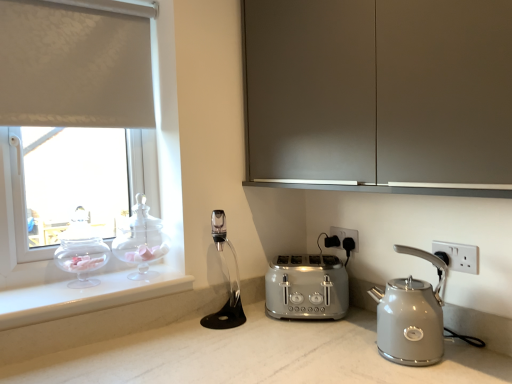
The height and width of the screenshot is (384, 512). I want to click on black plastic electric outlet at lower center, the 2th electric outlet viewed from the right, so click(x=345, y=235).

Locate an element on the screen. This screenshot has width=512, height=384. matte gray kettle at right is located at coordinates (411, 316).

This screenshot has height=384, width=512. What do you see at coordinates (306, 287) in the screenshot?
I see `satin silver toaster at center` at bounding box center [306, 287].

What is the approximate height of white plastic electric outlet at right, which is counted as the first electric outlet, starting from the front?

It is 3.47 inches.

What is the approximate height of transparent glass teapot at left, which is counted as the 1th tea pot, starting from the left?

It is 11.15 inches.

Locate an element on the screen. Image resolution: width=512 pixels, height=384 pixels. matte gray cabinet at upper center is located at coordinates (379, 95).

Between matte gray kettle at right and transparent glass teapot at left, which is the 2th tea pot in right-to-left order, which one is positioned in front?

matte gray kettle at right is closer to the camera.

Who is smaller, matte gray kettle at right or transparent glass teapot at left, which is the 2th tea pot in right-to-left order?

transparent glass teapot at left, which is the 2th tea pot in right-to-left order.

Consider the image. Can you confirm if matte gray kettle at right is thinner than transparent glass teapot at left, which is the 2th tea pot in right-to-left order?

No, matte gray kettle at right is not thinner than transparent glass teapot at left, which is the 2th tea pot in right-to-left order.

Is matte gray kettle at right aimed at transparent glass teapot at left, which is counted as the 1th tea pot, starting from the left?

No, matte gray kettle at right is not oriented towards transparent glass teapot at left, which is counted as the 1th tea pot, starting from the left.

Is matte gray cabinet at upper center facing towards clear glass jar at window, which appears as the second tea pot when viewed from the left?

No, matte gray cabinet at upper center does not turn towards clear glass jar at window, which appears as the second tea pot when viewed from the left.

Is matte gray cabinet at upper center with clear glass jar at window, which is the first tea pot from right to left?

No, matte gray cabinet at upper center is not touching clear glass jar at window, which is the first tea pot from right to left.

Is matte gray cabinet at upper center taller than clear glass jar at window, which is the first tea pot from right to left?

Correct, matte gray cabinet at upper center is much taller as clear glass jar at window, which is the first tea pot from right to left.

In the scene shown: Is there a large distance between white plastic electric outlet at right, which is the 2th electric outlet in back-to-front order, and matte gray kettle at right?

No, white plastic electric outlet at right, which is the 2th electric outlet in back-to-front order, is not far from matte gray kettle at right.

Which object is further away from the camera, white plastic electric outlet at right, which is the 2th electric outlet in back-to-front order, or matte gray kettle at right?

white plastic electric outlet at right, which is the 2th electric outlet in back-to-front order.

From the image's perspective, does white plastic electric outlet at right, which is the first electric outlet in right-to-left order, appear lower than matte gray kettle at right?

Actually, white plastic electric outlet at right, which is the first electric outlet in right-to-left order, appears above matte gray kettle at right in the image.

Considering the relative sizes of white plastic electric outlet at right, which is counted as the first electric outlet, starting from the front, and matte gray kettle at right in the image provided, is white plastic electric outlet at right, which is counted as the first electric outlet, starting from the front, thinner than matte gray kettle at right?

Yes.

At what (x,y) coordinates should I click in order to perform the action: click on toaster on the left of matte gray kettle at right. Please return your answer as a coordinate pair (x, y). Looking at the image, I should click on (306, 287).

Does matte gray kettle at right appear on the left side of satin silver toaster at center?

Incorrect, matte gray kettle at right is not on the left side of satin silver toaster at center.

Does matte gray kettle at right turn towards satin silver toaster at center?

No, matte gray kettle at right is not oriented towards satin silver toaster at center.

Considering the sizes of transparent glass teapot at left, which is the 2th tea pot in right-to-left order, and black plastic electric outlet at lower center, placed as the second electric outlet when sorted from front to back, in the image, is transparent glass teapot at left, which is the 2th tea pot in right-to-left order, bigger or smaller than black plastic electric outlet at lower center, placed as the second electric outlet when sorted from front to back,?

Clearly, transparent glass teapot at left, which is the 2th tea pot in right-to-left order, is larger in size than black plastic electric outlet at lower center, placed as the second electric outlet when sorted from front to back.

From the image's perspective, is transparent glass teapot at left, which is the 2th tea pot in right-to-left order, above or below black plastic electric outlet at lower center, placed as the second electric outlet when sorted from front to back?

transparent glass teapot at left, which is the 2th tea pot in right-to-left order, is above black plastic electric outlet at lower center, placed as the second electric outlet when sorted from front to back.

Is black plastic electric outlet at lower center, placed as the second electric outlet when sorted from front to back, inside transparent glass teapot at left, which is the 2th tea pot in right-to-left order?

Actually, black plastic electric outlet at lower center, placed as the second electric outlet when sorted from front to back, is outside transparent glass teapot at left, which is the 2th tea pot in right-to-left order.

Is transparent glass teapot at left, which is the 2th tea pot in right-to-left order, to the left of black plastic electric outlet at lower center, the first electric outlet in the back-to-front sequence, from the viewer's perspective?

Yes.

From a real-world perspective, which object rests below the other?

In real-world perspective, white plastic electric outlet at right, which is counted as the first electric outlet, starting from the front, is lower.

How much distance is there between transparent glass teapot at left, which is counted as the 1th tea pot, starting from the left, and white plastic electric outlet at right, which is the first electric outlet in right-to-left order?

transparent glass teapot at left, which is counted as the 1th tea pot, starting from the left, is 3.85 feet from white plastic electric outlet at right, which is the first electric outlet in right-to-left order.

Considering the positions of objects transparent glass teapot at left, which is the 2th tea pot in right-to-left order, and white plastic electric outlet at right, which is the first electric outlet in right-to-left order, in the image provided, who is in front, transparent glass teapot at left, which is the 2th tea pot in right-to-left order, or white plastic electric outlet at right, which is the first electric outlet in right-to-left order,?

white plastic electric outlet at right, which is the first electric outlet in right-to-left order.

From a real-world perspective, is white plastic electric outlet at right, which is counted as the first electric outlet, starting from the front, located higher than clear glass jar at window, which appears as the second tea pot when viewed from the left?

No, from a real-world perspective, white plastic electric outlet at right, which is counted as the first electric outlet, starting from the front, is not on top of clear glass jar at window, which appears as the second tea pot when viewed from the left.

From the image's perspective, which electric outlet is the 2nd one below the clear glass jar at window, which is the first tea pot from right to left? Please provide its 2D coordinates.

[(458, 256)]

In the scene shown: From the image's perspective, between white plastic electric outlet at right, which ranks as the 2th electric outlet in left-to-right order, and clear glass jar at window, which is the first tea pot from right to left, which one is located above?

From the image's view, clear glass jar at window, which is the first tea pot from right to left, is above.

Measure the distance from white plastic electric outlet at right, which ranks as the 2th electric outlet in left-to-right order, to clear glass jar at window, which appears as the second tea pot when viewed from the left.

white plastic electric outlet at right, which ranks as the 2th electric outlet in left-to-right order, is 1.04 meters from clear glass jar at window, which appears as the second tea pot when viewed from the left.

There is a matte gray kettle at right. Identify the location of the 1st tea pot above it (from the image's perspective). (81, 250).

In order to click on tea pot that is the 1st one when counting downward from the matte gray cabinet at upper center (from the image's perspective) in this screenshot , I will do `click(141, 241)`.

Looking at the image, which one is located closer to satin silver toaster at center, clear glass jar at window, which appears as the second tea pot when viewed from the left, or white plastic electric outlet at right, which is counted as the first electric outlet, starting from the front?

Among the two, white plastic electric outlet at right, which is counted as the first electric outlet, starting from the front, is located nearer to satin silver toaster at center.

When comparing their distances from black plastic electric outlet at lower center, the 2th electric outlet viewed from the right, does satin silver toaster at center or matte gray cabinet at upper center seem further?

matte gray cabinet at upper center is further to black plastic electric outlet at lower center, the 2th electric outlet viewed from the right.

Based on the photo, when comparing their distances from black plastic electric outlet at lower center, marked as the first electric outlet in a left-to-right arrangement, does white plastic electric outlet at right, which is counted as the first electric outlet, starting from the front, or matte gray cabinet at upper center seem further?

Among the two, matte gray cabinet at upper center is located further to black plastic electric outlet at lower center, marked as the first electric outlet in a left-to-right arrangement.

Looking at the image, which one is located closer to white plastic electric outlet at right, which is the 2th electric outlet in back-to-front order, matte gray cabinet at upper center or black plastic electric outlet at lower center, placed as the second electric outlet when sorted from front to back?

black plastic electric outlet at lower center, placed as the second electric outlet when sorted from front to back, is positioned closer to the anchor white plastic electric outlet at right, which is the 2th electric outlet in back-to-front order.

From the image, which object appears to be farther from matte gray cabinet at upper center, matte gray kettle at right or black plastic electric outlet at lower center, placed as the second electric outlet when sorted from front to back?

black plastic electric outlet at lower center, placed as the second electric outlet when sorted from front to back, is further to matte gray cabinet at upper center.

From the image, which object appears to be nearer to clear glass jar at window, which appears as the second tea pot when viewed from the left, satin silver toaster at center or black plastic electric outlet at lower center, marked as the first electric outlet in a left-to-right arrangement?

Based on the image, satin silver toaster at center appears to be nearer to clear glass jar at window, which appears as the second tea pot when viewed from the left.

When comparing their distances from white plastic electric outlet at right, which is the first electric outlet in right-to-left order, does transparent glass teapot at left, which is counted as the 1th tea pot, starting from the left, or black plastic electric outlet at lower center, the 2th electric outlet viewed from the right, seem further?

transparent glass teapot at left, which is counted as the 1th tea pot, starting from the left, lies further to white plastic electric outlet at right, which is the first electric outlet in right-to-left order, than the other object.

Based on their spatial positions, is matte gray cabinet at upper center or white plastic electric outlet at right, which is the first electric outlet in right-to-left order, closer to matte gray kettle at right?

white plastic electric outlet at right, which is the first electric outlet in right-to-left order.

The image size is (512, 384). Find the location of `electric outlet between transparent glass teapot at left, which is the 2th tea pot in right-to-left order, and matte gray kettle at right`. electric outlet between transparent glass teapot at left, which is the 2th tea pot in right-to-left order, and matte gray kettle at right is located at coordinates (345, 235).

Find the location of a particular element. The width and height of the screenshot is (512, 384). electric outlet between transparent glass teapot at left, which is counted as the 1th tea pot, starting from the left, and matte gray cabinet at upper center is located at coordinates pyautogui.click(x=345, y=235).

The image size is (512, 384). In order to click on cabinetry between clear glass jar at window, which is the first tea pot from right to left, and white plastic electric outlet at right, which ranks as the 2th electric outlet in left-to-right order in this screenshot , I will do `click(379, 95)`.

Where is `toaster between clear glass jar at window, which appears as the second tea pot when viewed from the left, and matte gray kettle at right, in the horizontal direction`? toaster between clear glass jar at window, which appears as the second tea pot when viewed from the left, and matte gray kettle at right, in the horizontal direction is located at coordinates (306, 287).